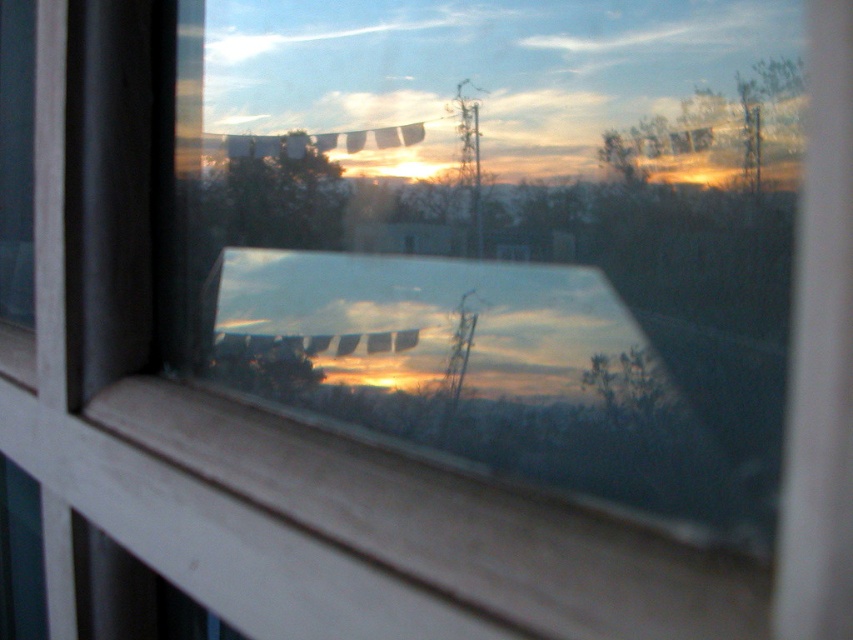
You are a passenger on a train and looking out the transparent glass train window at center. You notice the green matte tree at upper center reflected in the window. Which object is taller?

The transparent glass train window at center is much taller than the green matte tree at upper center, so the transparent glass train window at center is taller.